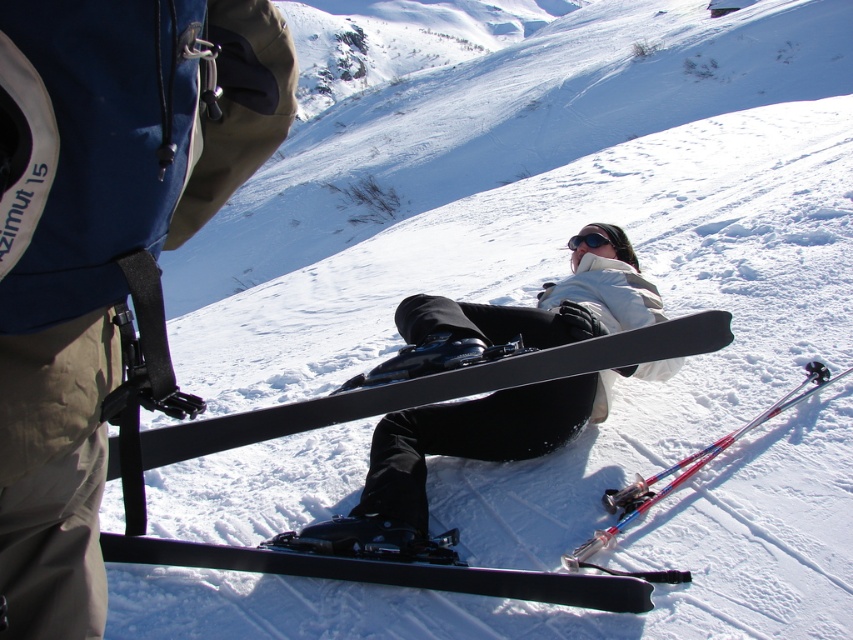
You are a photographer trying to capture the scene with the matte black snowboard at center and the black matte ski at center. Which object should you focus on first if you want to include both in your shot without moving the camera?

The matte black snowboard at center is positioned on the right side of the black matte ski at center, so you should focus on the black matte ski at center first to ensure both are in frame.